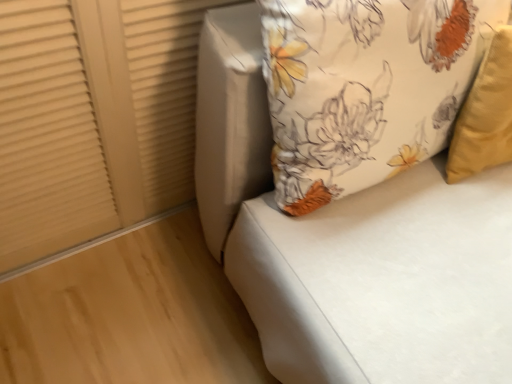
Question: Is matte beige shutter at upper left looking in the opposite direction of floral fabric cushion at upper right?

Choices:
 (A) yes
 (B) no

Answer: (B)

Question: Is matte beige shutter at upper left thinner than floral fabric cushion at upper right?

Choices:
 (A) yes
 (B) no

Answer: (A)

Question: Would you say matte beige shutter at upper left is a long distance from floral fabric cushion at upper right?

Choices:
 (A) yes
 (B) no

Answer: (B)

Question: Is matte beige shutter at upper left further to camera compared to floral fabric cushion at upper right?

Choices:
 (A) yes
 (B) no

Answer: (A)

Question: Is matte beige shutter at upper left to the right of floral fabric cushion at upper right from the viewer's perspective?

Choices:
 (A) yes
 (B) no

Answer: (B)

Question: From the image's perspective, is matte beige shutter at upper left on top of floral fabric cushion at upper right?

Choices:
 (A) no
 (B) yes

Answer: (B)

Question: Is floral fabric pillow at upper right to the right of floral fabric cushion at upper right from the viewer's perspective?

Choices:
 (A) no
 (B) yes

Answer: (A)

Question: From a real-world perspective, is floral fabric pillow at upper right physically above floral fabric cushion at upper right?

Choices:
 (A) no
 (B) yes

Answer: (B)

Question: Is floral fabric pillow at upper right not close to floral fabric cushion at upper right?

Choices:
 (A) no
 (B) yes

Answer: (A)

Question: Considering the relative sizes of floral fabric pillow at upper right and floral fabric cushion at upper right in the image provided, is floral fabric pillow at upper right taller than floral fabric cushion at upper right?

Choices:
 (A) yes
 (B) no

Answer: (B)

Question: Would you say floral fabric cushion at upper right is part of floral fabric pillow at upper right's contents?

Choices:
 (A) yes
 (B) no

Answer: (B)

Question: Is floral fabric pillow at upper right next to floral fabric cushion at upper right and touching it?

Choices:
 (A) no
 (B) yes

Answer: (A)

Question: Is floral fabric cushion at upper right shorter than matte beige shutter at upper left?

Choices:
 (A) no
 (B) yes

Answer: (A)